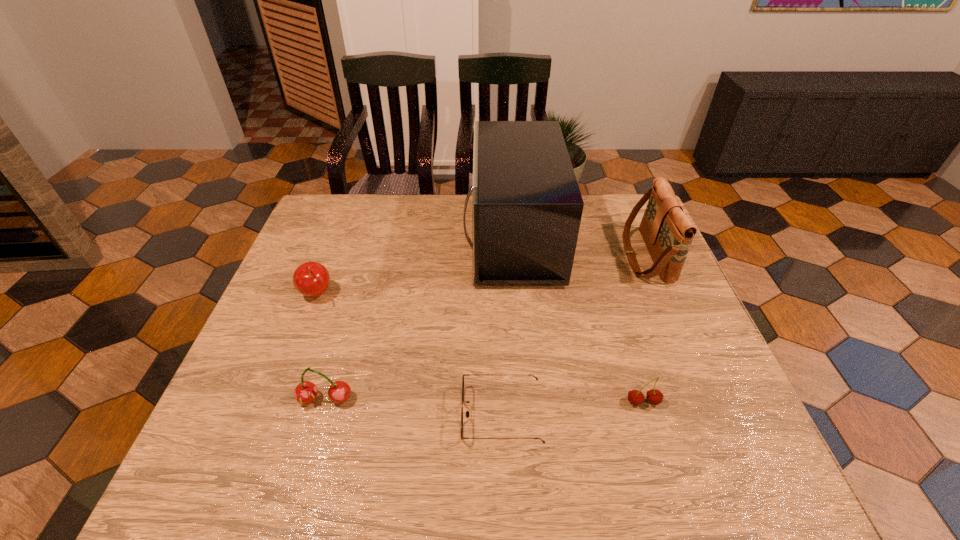
Where is `vacant area that lies between the second cherry from right to left and the leftmost object`? The image size is (960, 540). vacant area that lies between the second cherry from right to left and the leftmost object is located at coordinates (321, 347).

This screenshot has width=960, height=540. What are the coordinates of `blank region between the sunglasses and the tallest object` in the screenshot? It's located at (507, 326).

In order to click on vacant region between the second cherry from right to left and the second object from right to left in this screenshot , I will do `click(484, 401)`.

Identify the location of free space between the second shortest object and the leftmost cherry. (479, 348).

Locate which object ranks fifth in proximity to the second object from left to right. Please provide its 2D coordinates. Your answer should be formatted as a tuple, i.e. [(x, y)], where the tuple contains the x and y coordinates of a point satisfying the conditions above.

[(667, 232)]

At what (x,y) coordinates should I click in order to perform the action: click on object that can be found as the fifth closest to the tallest object. Please return your answer as a coordinate pair (x, y). Looking at the image, I should click on (305, 392).

Identify which cherry is the second closest to the rightmost cherry. Please provide its 2D coordinates. Your answer should be formatted as a tuple, i.e. [(x, y)], where the tuple contains the x and y coordinates of a point satisfying the conditions above.

[(311, 279)]

At what (x,y) coordinates should I click in order to perform the action: click on cherry that is the closest to the shoulder bag. Please return your answer as a coordinate pair (x, y). This screenshot has height=540, width=960. Looking at the image, I should click on (635, 397).

I want to click on free space that satisfies the following two spatial constraints: 1. with the door open on the microwave oven; 2. on the front side of the farthest cherry, so click(x=516, y=294).

Find the location of a particular element. free point that satisfies the following two spatial constraints: 1. on the surface of the second object from right to left; 2. on the front-facing side of the sunglasses is located at coordinates (647, 414).